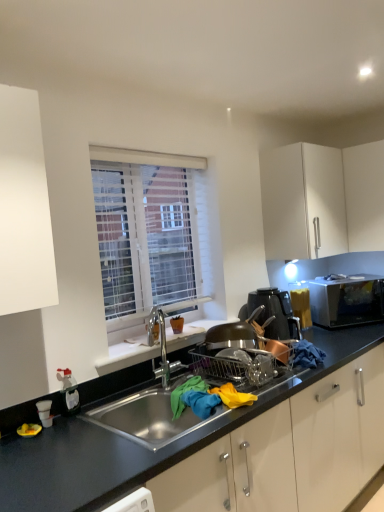
Question: Considering the relative positions of stainless steel sink at center and metallic copper pot at right in the image provided, is stainless steel sink at center to the left of metallic copper pot at right from the viewer's perspective?

Choices:
 (A) yes
 (B) no

Answer: (A)

Question: Is stainless steel sink at center taller than metallic copper pot at right?

Choices:
 (A) yes
 (B) no

Answer: (A)

Question: Is stainless steel sink at center in front of metallic copper pot at right?

Choices:
 (A) yes
 (B) no

Answer: (A)

Question: From a real-world perspective, is stainless steel sink at center on top of metallic copper pot at right?

Choices:
 (A) yes
 (B) no

Answer: (B)

Question: Would you say stainless steel sink at center contains metallic copper pot at right?

Choices:
 (A) no
 (B) yes

Answer: (A)

Question: Is white matte cabinet at upper right inside the boundaries of white textured blinds at upper center, or outside?

Choices:
 (A) outside
 (B) inside

Answer: (A)

Question: In terms of width, does white matte cabinet at upper right look wider or thinner when compared to white textured blinds at upper center?

Choices:
 (A) thin
 (B) wide

Answer: (B)

Question: Is white matte cabinet at upper right taller or shorter than white textured blinds at upper center?

Choices:
 (A) short
 (B) tall

Answer: (A)

Question: Is white matte cabinet at upper right to the left or to the right of white textured blinds at upper center in the image?

Choices:
 (A) left
 (B) right

Answer: (B)

Question: From a real-world perspective, is white textured blinds at upper center physically located above or below white matte window sill at center?

Choices:
 (A) below
 (B) above

Answer: (B)

Question: Choose the correct answer: Is white textured blinds at upper center inside white matte window sill at center or outside it?

Choices:
 (A) inside
 (B) outside

Answer: (B)

Question: From the image's perspective, is white textured blinds at upper center above or below white matte window sill at center?

Choices:
 (A) above
 (B) below

Answer: (A)

Question: Does point (120, 168) appear closer or farther from the camera than point (102, 367)?

Choices:
 (A) farther
 (B) closer

Answer: (A)

Question: In terms of height, does satin silver microwave at right look taller or shorter compared to white matte window sill at center?

Choices:
 (A) tall
 (B) short

Answer: (A)

Question: Considering the positions of satin silver microwave at right and white matte window sill at center in the image, is satin silver microwave at right wider or thinner than white matte window sill at center?

Choices:
 (A) thin
 (B) wide

Answer: (B)